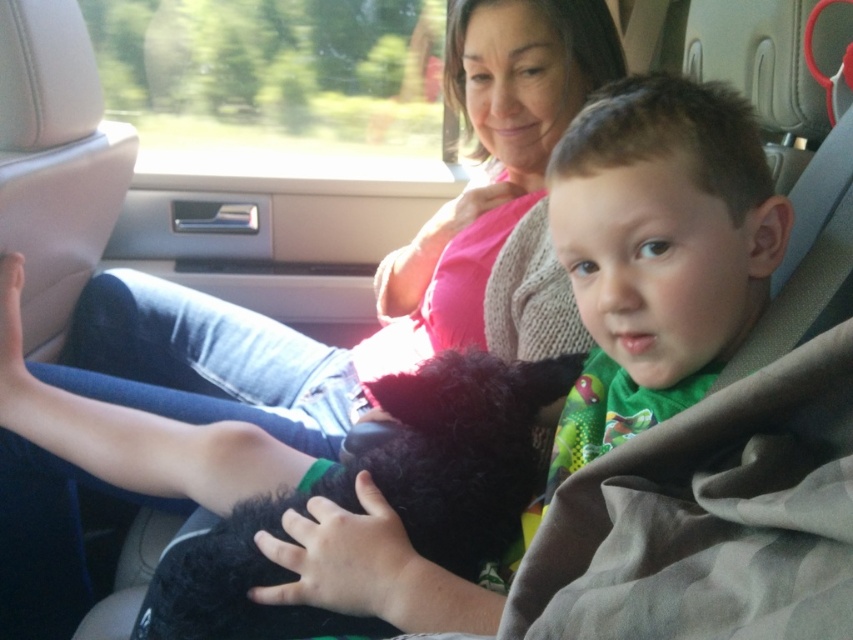
Between point (654, 401) and point (537, 452), which one is positioned behind?

The point (537, 452) is more distant.

Is green jersey at center above black fuzzy dog at center?

Indeed, green jersey at center is positioned over black fuzzy dog at center.

This screenshot has height=640, width=853. Identify the location of green jersey at center. (659, 250).

This screenshot has width=853, height=640. I want to click on green jersey at center, so click(x=659, y=250).